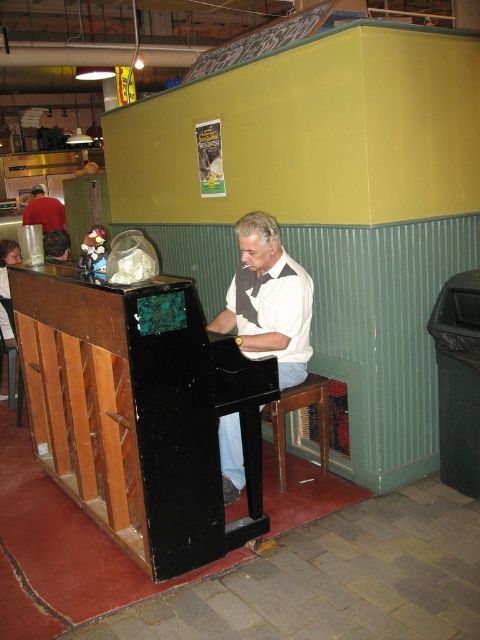
Question: Which is farther from the wooden at center?

Choices:
 (A) red shirt at left
 (B) matte black piano at center

Answer: (A)

Question: Is wooden at center to the left of red shirt at left from the viewer's perspective?

Choices:
 (A) yes
 (B) no

Answer: (B)

Question: Which point is farther to the camera?

Choices:
 (A) matte black piano at center
 (B) wooden at center
 (C) red shirt at left

Answer: (C)

Question: Estimate the real-world distances between objects in this image. Which object is closer to the wooden at center?

Choices:
 (A) red shirt at left
 (B) matte black piano at center

Answer: (B)

Question: Can you confirm if wooden at center is positioned above red shirt at left?

Choices:
 (A) no
 (B) yes

Answer: (A)

Question: From the image, what is the correct spatial relationship of matte black piano at center in relation to red shirt at left?

Choices:
 (A) above
 (B) below

Answer: (B)